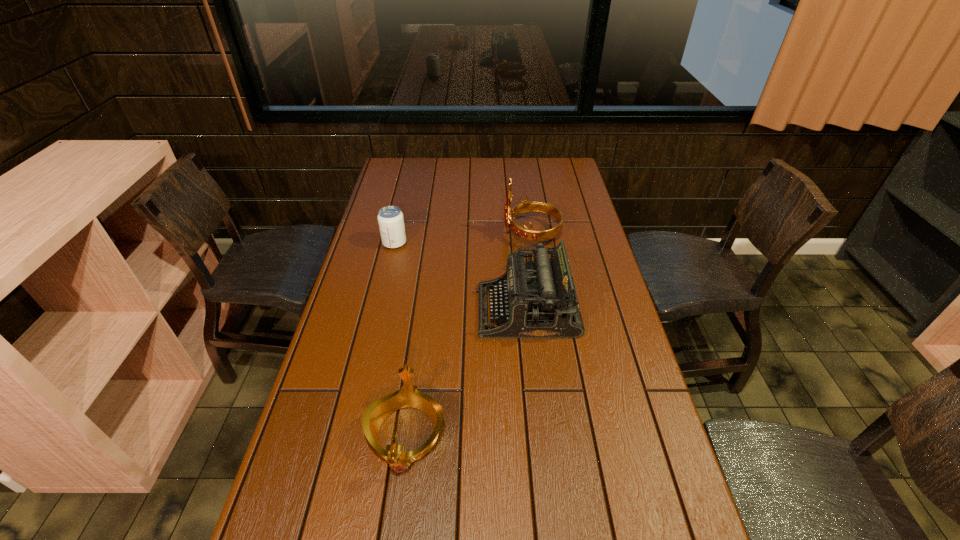
Where is `vacant space at the right edge`? The width and height of the screenshot is (960, 540). vacant space at the right edge is located at coordinates (572, 271).

I want to click on vacant space at the far right corner, so click(x=564, y=174).

Locate an element on the screen. The image size is (960, 540). blank region between the nearer tiara and the soda can is located at coordinates (400, 339).

Where is `blank region between the taller tiara and the soda can`? The image size is (960, 540). blank region between the taller tiara and the soda can is located at coordinates (463, 238).

I want to click on empty location between the nearest object and the soda can, so click(x=400, y=339).

Where is `empty space between the second tallest object and the soda can`? empty space between the second tallest object and the soda can is located at coordinates (461, 277).

The width and height of the screenshot is (960, 540). Identify the location of vacant area that lies between the shorter tiara and the soda can. (400, 339).

Find the location of a particular element. unoccupied position between the left tiara and the second nearest object is located at coordinates (467, 373).

Identify the location of free space between the right tiara and the soda can. (463, 238).

The image size is (960, 540). I want to click on empty location between the soda can and the second nearest object, so click(461, 277).